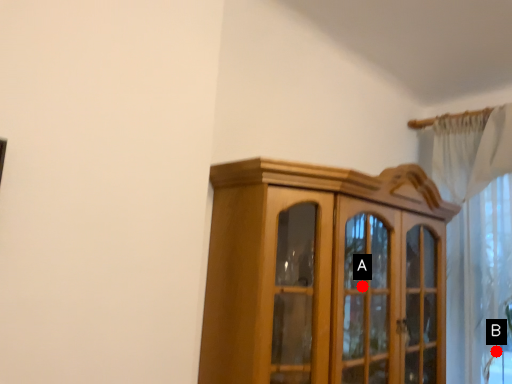
Question: Two points are circled on the image, labeled by A and B beside each circle. Which point is farther from the camera taking this photo?

Choices:
 (A) A is further
 (B) B is further

Answer: (B)